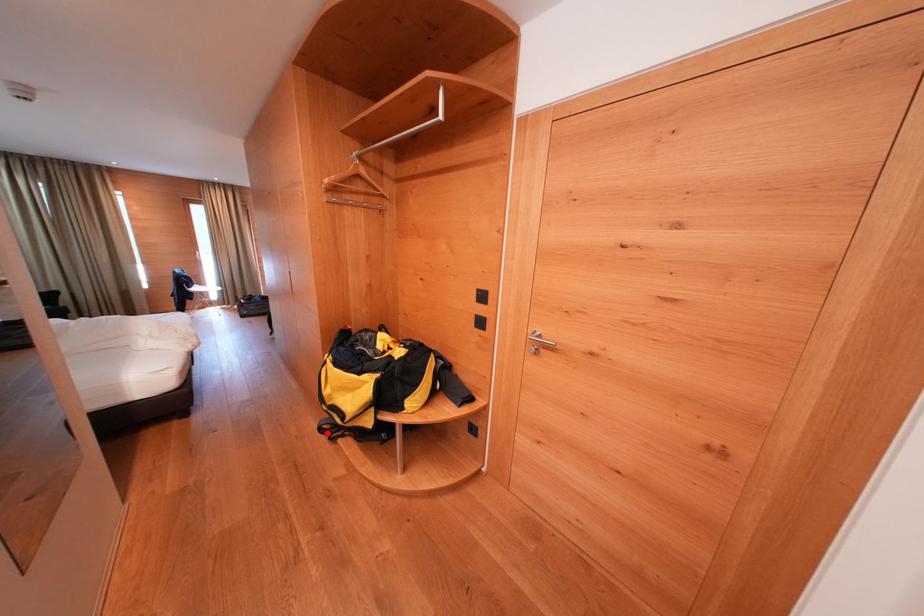
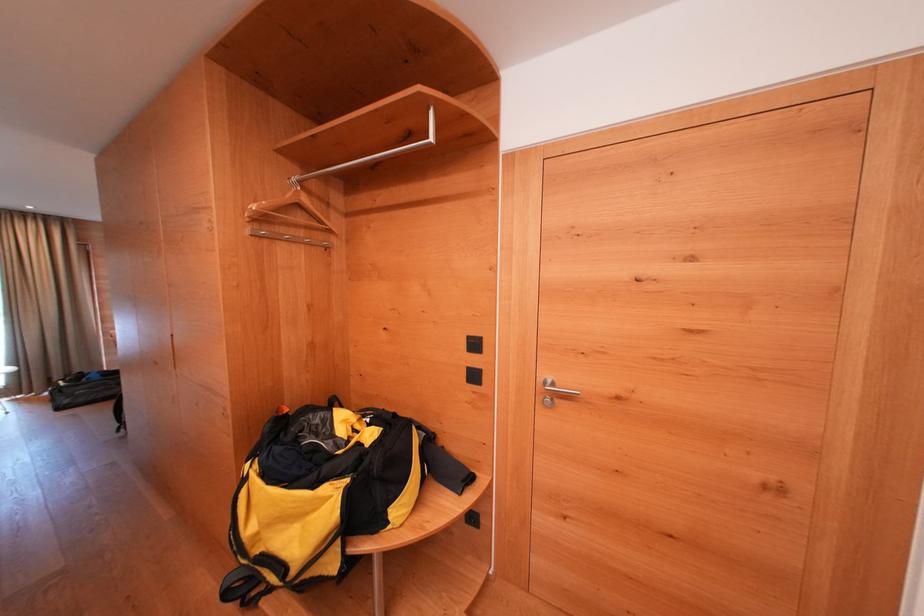
Question: I am providing you with two images of the same scene from different viewpoints. Image1 has a red point marked. In image2, the corresponding 3D location appears at what relative position? Reply with the corresponding letter.

Choices:
 (A) Closer
 (B) Farther

Answer: (A)